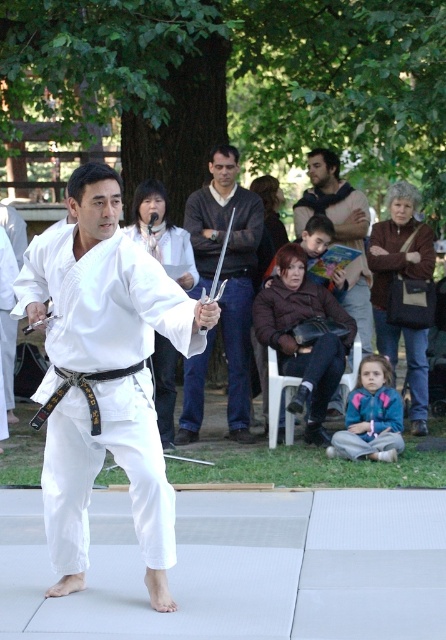
You are a photographer at the martial arts demonstration. You want to take a photo of the matte black sweater at center and the brown leather jacket at center. Which object should you focus on first to ensure both are in focus?

The matte black sweater at center is closer to the viewer than the brown leather jacket at center, so focus on the matte black sweater at center first to ensure both are in focus.